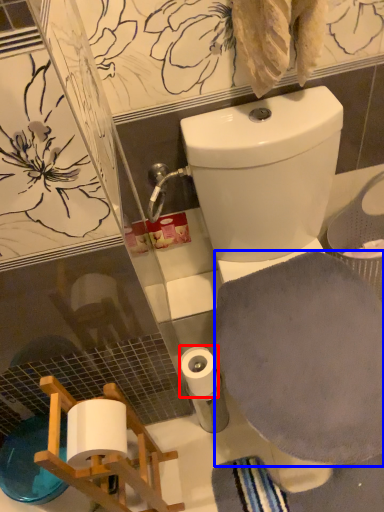
Question: Which object is further to the camera taking this photo, toilet paper (highlighted by a red box) or bath towel (highlighted by a blue box)?

Choices:
 (A) toilet paper
 (B) bath towel

Answer: (A)